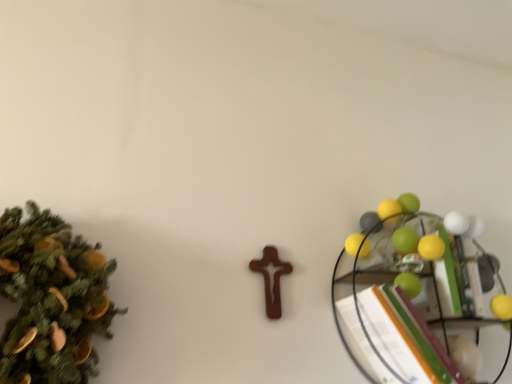
Question: Is green matte christmas tree at left oriented away from metallic wire shelf at right?

Choices:
 (A) no
 (B) yes

Answer: (A)

Question: Is metallic wire shelf at right located within green matte christmas tree at left?

Choices:
 (A) yes
 (B) no

Answer: (B)

Question: Is green matte christmas tree at left bigger than metallic wire shelf at right?

Choices:
 (A) yes
 (B) no

Answer: (B)

Question: Does green matte christmas tree at left have a smaller size compared to metallic wire shelf at right?

Choices:
 (A) no
 (B) yes

Answer: (B)

Question: Does green matte christmas tree at left have a lesser height compared to metallic wire shelf at right?

Choices:
 (A) yes
 (B) no

Answer: (A)

Question: Does green matte christmas tree at left have a greater height compared to metallic wire shelf at right?

Choices:
 (A) yes
 (B) no

Answer: (B)

Question: Does metallic wire shelf at right appear on the left side of green matte christmas tree at left?

Choices:
 (A) yes
 (B) no

Answer: (B)

Question: Does metallic wire shelf at right have a lesser width compared to green matte christmas tree at left?

Choices:
 (A) no
 (B) yes

Answer: (B)

Question: Would you say metallic wire shelf at right is a long distance from green matte christmas tree at left?

Choices:
 (A) yes
 (B) no

Answer: (B)

Question: From a real-world perspective, is metallic wire shelf at right beneath green matte christmas tree at left?

Choices:
 (A) no
 (B) yes

Answer: (B)

Question: Does metallic wire shelf at right appear on the right side of green matte christmas tree at left?

Choices:
 (A) no
 (B) yes

Answer: (B)

Question: From the image's perspective, does metallic wire shelf at right appear lower than green matte christmas tree at left?

Choices:
 (A) no
 (B) yes

Answer: (B)

Question: From the image's perspective, is metallic wire shelf at right positioned above or below green matte christmas tree at left?

Choices:
 (A) above
 (B) below

Answer: (B)